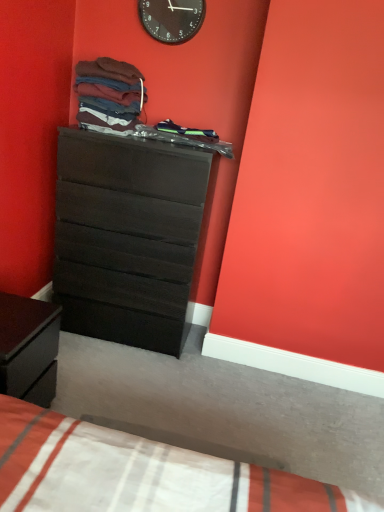
Question: From a real-world perspective, relative to matte black dresser at center, is dark wood nightstand at lower left vertically above or below?

Choices:
 (A) below
 (B) above

Answer: (A)

Question: Based on their sizes in the image, would you say dark wood nightstand at lower left is bigger or smaller than matte black dresser at center?

Choices:
 (A) small
 (B) big

Answer: (A)

Question: Considering the real-world distances, which object is farthest from the dark blue fabric at center, arranged as the first clothing when viewed from the right?

Choices:
 (A) black plastic wall clock at upper center
 (B) white cotton bed at lower left
 (C) dark wood nightstand at lower left
 (D) matte black dresser at center
 (E) matte cotton shirts at upper center, the 1th clothing in the left-to-right sequence

Answer: (B)

Question: Which object is positioned closest to the matte cotton shirts at upper center, the second clothing when ordered from right to left?

Choices:
 (A) black plastic wall clock at upper center
 (B) dark blue fabric at center, arranged as the first clothing when viewed from the right
 (C) dark wood nightstand at lower left
 (D) matte black dresser at center
 (E) white cotton bed at lower left

Answer: (B)